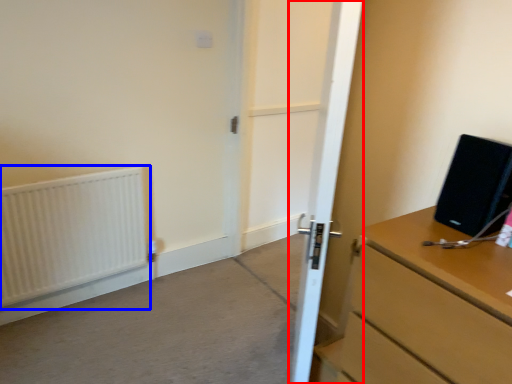
Question: Which point is further to the camera, door (highlighted by a red box) or radiator (highlighted by a blue box)?

Choices:
 (A) door
 (B) radiator

Answer: (B)